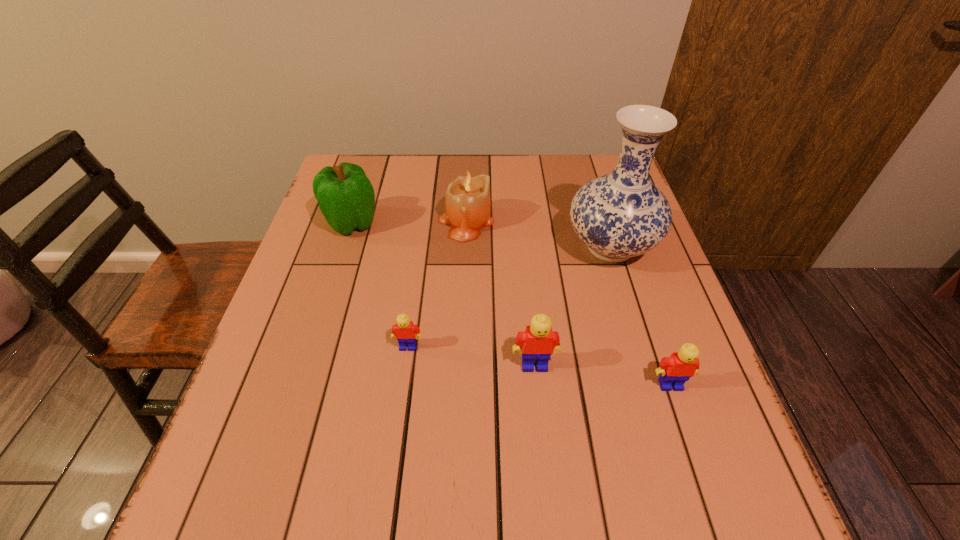
Locate an element on the screen. free space located on the front-facing side of the second farthest Lego is located at coordinates (542, 442).

Where is `vacant space located on the right of the candle`? Image resolution: width=960 pixels, height=540 pixels. vacant space located on the right of the candle is located at coordinates (612, 222).

This screenshot has width=960, height=540. Identify the location of free space located on the front of the bell pepper. (320, 324).

Find the location of a particular element. vacant position located 0.360m on the left of the vase is located at coordinates (423, 247).

Find the location of `object that is at the left edge`. object that is at the left edge is located at coordinates (346, 198).

Where is `Lego located in the right edge section of the desktop`? This screenshot has width=960, height=540. Lego located in the right edge section of the desktop is located at coordinates (675, 370).

Locate an element on the screen. The width and height of the screenshot is (960, 540). vase that is at the right edge is located at coordinates (619, 215).

The width and height of the screenshot is (960, 540). I want to click on vacant area at the far edge of the desktop, so click(508, 156).

Where is `free space at the near edge`? free space at the near edge is located at coordinates (396, 426).

At what (x,y) coordinates should I click in order to perform the action: click on blank area at the left edge. Please return your answer as a coordinate pair (x, y). Looking at the image, I should click on (338, 336).